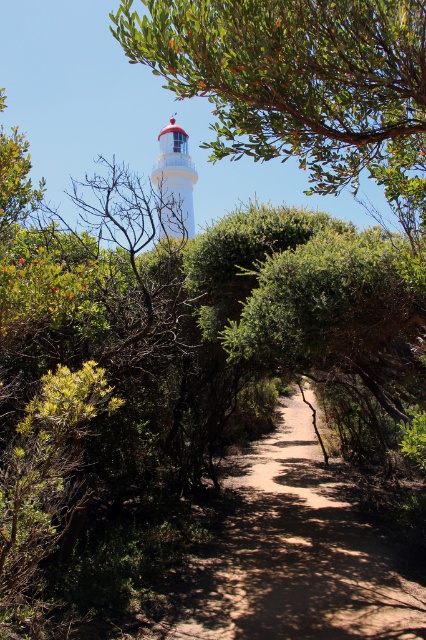
Question: Which object is closer to the camera taking this photo?

Choices:
 (A) dirt path at center
 (B) green leafy tree at upper center

Answer: (B)

Question: Does dirt path at center have a greater width compared to white matte lighthouse at upper center?

Choices:
 (A) yes
 (B) no

Answer: (A)

Question: Can you confirm if dirt path at center is positioned to the right of white matte lighthouse at upper center?

Choices:
 (A) yes
 (B) no

Answer: (A)

Question: Which point is closer to the camera?

Choices:
 (A) (414, 81)
 (B) (362, 573)
 (C) (189, 180)

Answer: (A)

Question: Which of the following is the closest to the observer?

Choices:
 (A) (420, 160)
 (B) (178, 193)

Answer: (A)

Question: Does green leafy tree at upper center have a greater width compared to white matte lighthouse at upper center?

Choices:
 (A) no
 (B) yes

Answer: (B)